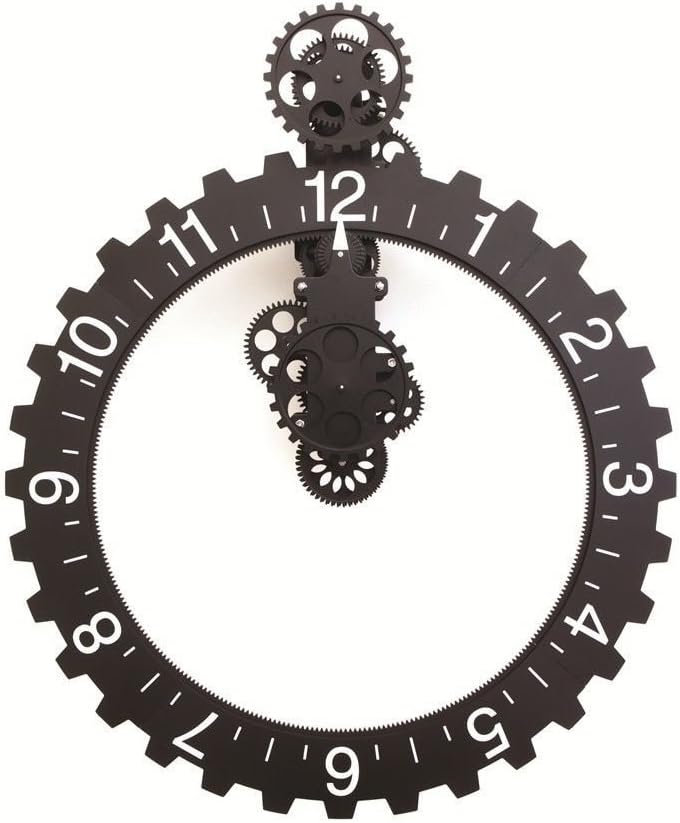
You are a GUI agent. You are given a task and a screenshot of the screen. Output one action in this format:
    pyautogui.click(x=<x>, y=<y>)
    Task: Click on the clock
    The width and height of the screenshot is (680, 823).
    Given the screenshot: What is the action you would take?
    pyautogui.click(x=509, y=286)